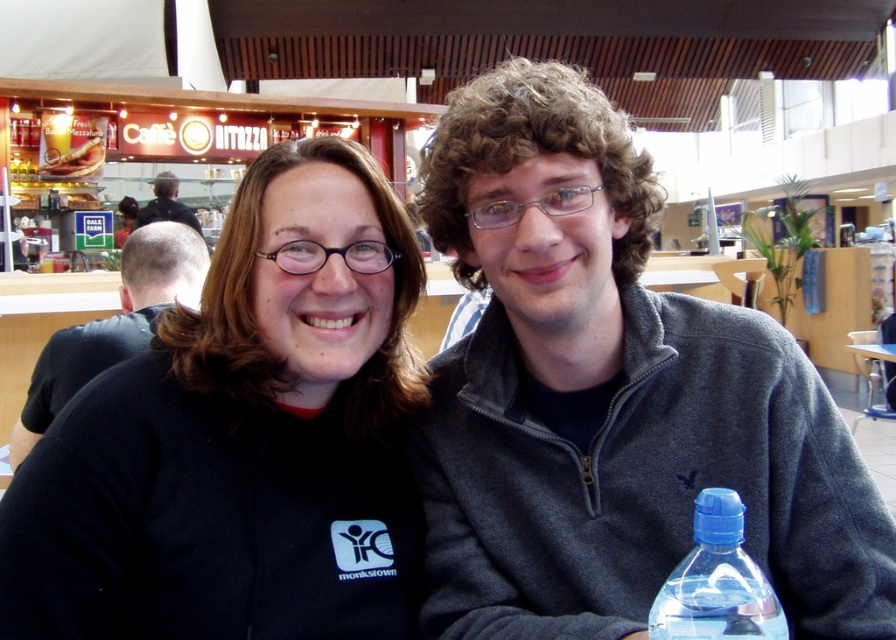
You are a photographer trying to capture a photo of the black fleece jacket at center and the transparent plastic bottle at lower right. Which object should you focus on first if you want to ensure both are in focus without adjusting the camera settings?

The black fleece jacket at center is much taller than the transparent plastic bottle at lower right, so focusing on the black fleece jacket at center first will help ensure both are in focus since it is larger and closer to the camera.